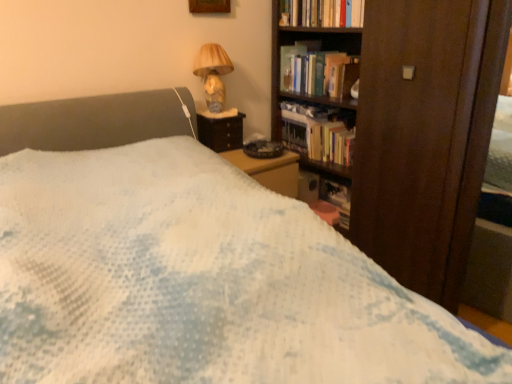
Question: Considering their positions, is dark brown wooden bookcase at right located in front of or behind hardcover books at upper center, acting as the 1th book starting from the top?

Choices:
 (A) behind
 (B) front

Answer: (B)

Question: In the image, is dark brown wooden bookcase at right on the left side or the right side of hardcover books at upper center, arranged as the fourth book when ordered from the bottom?

Choices:
 (A) right
 (B) left

Answer: (A)

Question: Considering the real-world distances, which object is farthest from the dark brown wooden bookcase at right?

Choices:
 (A) hardcover books at center, which appears as the 3th book when ordered from the bottom
 (B) wooden nightstand at upper right
 (C) matte glass table lamp at upper right
 (D) hardcover book at upper right
 (E) hardcover books at upper center, acting as the 1th book starting from the top

Answer: (D)

Question: Which is farther from the hardcover book at upper right?

Choices:
 (A) hardcover books at center, which appears as the 3th book when ordered from the bottom
 (B) wooden picture frame at upper center
 (C) wooden nightstand at upper right
 (D) matte glass table lamp at upper right
 (E) hardcover books at upper center, acting as the 1th book starting from the top

Answer: (C)